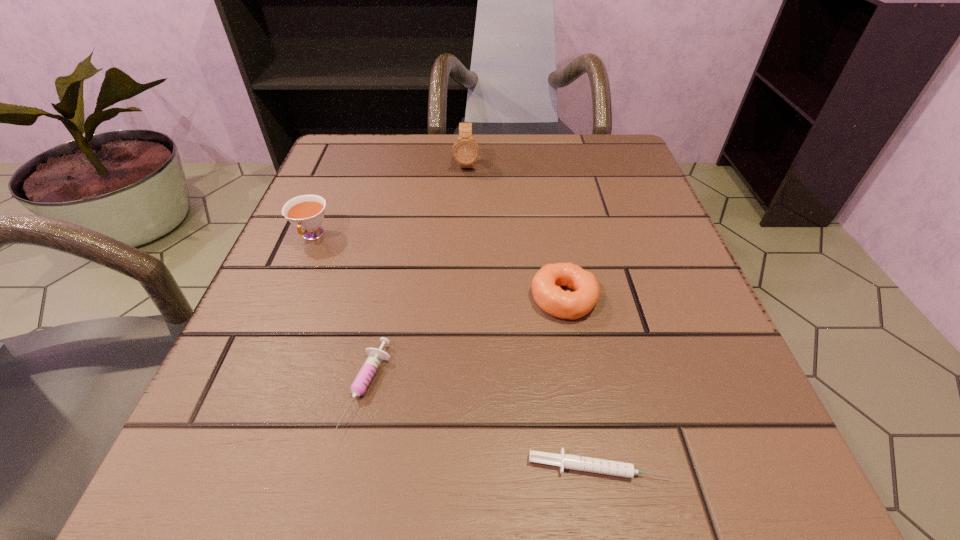
Identify the location of the tallest object. The width and height of the screenshot is (960, 540). (465, 151).

Identify the location of the third object from left to right. The width and height of the screenshot is (960, 540). (465, 151).

The image size is (960, 540). What are the coordinates of `the fourth shortest object` in the screenshot? It's located at (306, 212).

Locate an element on the screen. the second farthest object is located at coordinates (306, 212).

Where is `the third tallest object`? This screenshot has width=960, height=540. the third tallest object is located at coordinates (546, 285).

Find the location of a particular element. This screenshot has height=540, width=960. the third nearest object is located at coordinates (546, 285).

Locate an element on the screen. The image size is (960, 540). the second shortest object is located at coordinates (364, 377).

The image size is (960, 540). Find the location of `the taller syringe`. the taller syringe is located at coordinates (364, 377).

This screenshot has width=960, height=540. In order to click on the right syringe in this screenshot , I will do `click(601, 466)`.

The height and width of the screenshot is (540, 960). Identify the location of the nearest object. pos(601,466).